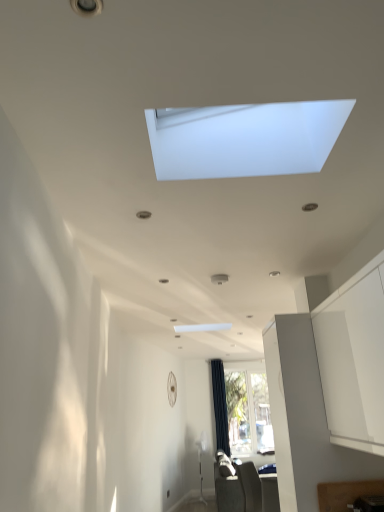
Question: Is dark gray fabric sofa at lower center, which is the first furniture in back-to-front order, completely or partially inside clear glass window at center, the 2th window viewed from the top?

Choices:
 (A) no
 (B) yes

Answer: (A)

Question: Is clear glass window at center, the 2th window viewed from the top, positioned with its back to dark gray fabric sofa at lower center, which is the first furniture in back-to-front order?

Choices:
 (A) no
 (B) yes

Answer: (A)

Question: From a real-world perspective, is clear glass window at center, arranged as the 1th window when ordered from the bottom, physically above dark gray fabric sofa at lower center, placed as the second furniture when sorted from top to bottom?

Choices:
 (A) yes
 (B) no

Answer: (A)

Question: Would you consider clear glass window at center, acting as the 2th window starting from the left, to be distant from dark gray fabric sofa at lower center, which is the 1th furniture from bottom to top?

Choices:
 (A) yes
 (B) no

Answer: (A)

Question: From the image's perspective, is clear glass window at center, arranged as the 1th window when ordered from the bottom, below dark gray fabric sofa at lower center, which is the first furniture in back-to-front order?

Choices:
 (A) yes
 (B) no

Answer: (B)

Question: Considering the relative positions of clear glass window at center, the 2th window viewed from the top, and white matte window at upper center, the first window from the left, in the image provided, is clear glass window at center, the 2th window viewed from the top, to the left or to the right of white matte window at upper center, the first window from the left,?

Choices:
 (A) left
 (B) right

Answer: (B)

Question: In terms of width, does clear glass window at center, which ranks as the second window in front-to-back order, look wider or thinner when compared to white matte window at upper center, positioned as the 1th window in top-to-bottom order?

Choices:
 (A) wide
 (B) thin

Answer: (A)

Question: Considering the positions of clear glass window at center, positioned as the first window in back-to-front order, and white matte window at upper center, arranged as the 1th window when viewed from the front, in the image, is clear glass window at center, positioned as the first window in back-to-front order, bigger or smaller than white matte window at upper center, arranged as the 1th window when viewed from the front,?

Choices:
 (A) small
 (B) big

Answer: (B)

Question: In terms of height, does clear glass window at center, acting as the 2th window starting from the left, look taller or shorter compared to white matte window at upper center, which is the second window from bottom to top?

Choices:
 (A) tall
 (B) short

Answer: (A)

Question: In the image, is dark gray fabric sofa at lower center, which is the first furniture in back-to-front order, positioned in front of or behind white matte window at upper center, arranged as the 1th window when viewed from the front?

Choices:
 (A) behind
 (B) front

Answer: (A)

Question: From the image's perspective, is dark gray fabric sofa at lower center, which is the 1th furniture from bottom to top, positioned above or below white matte window at upper center, positioned as the second window in right-to-left order?

Choices:
 (A) above
 (B) below

Answer: (B)

Question: Is dark gray fabric sofa at lower center, which is the first furniture in back-to-front order, situated inside white matte window at upper center, positioned as the 1th window in top-to-bottom order, or outside?

Choices:
 (A) outside
 (B) inside

Answer: (A)

Question: Is dark gray fabric sofa at lower center, placed as the second furniture when sorted from top to bottom, wider or thinner than white matte window at upper center, arranged as the 1th window when viewed from the front?

Choices:
 (A) thin
 (B) wide

Answer: (B)

Question: Considering the relative positions of black fabric curtain at center and dark gray fabric sofa at lower center, placed as the second furniture when sorted from top to bottom, in the image provided, is black fabric curtain at center to the left or to the right of dark gray fabric sofa at lower center, placed as the second furniture when sorted from top to bottom,?

Choices:
 (A) right
 (B) left

Answer: (B)

Question: Considering their positions, is black fabric curtain at center located in front of or behind dark gray fabric sofa at lower center, which is the 1th furniture from bottom to top?

Choices:
 (A) front
 (B) behind

Answer: (B)